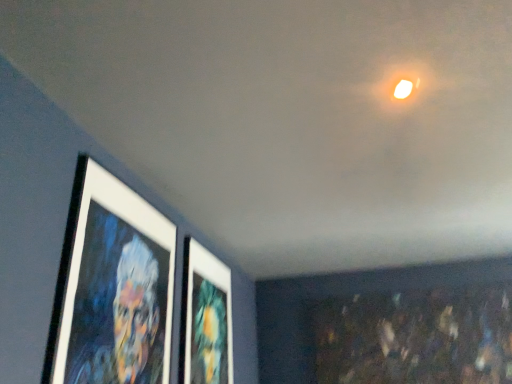
Measure the distance between point (127, 305) and camera.

The depth of point (127, 305) is 4.96 feet.

This screenshot has height=384, width=512. What do you see at coordinates (113, 286) in the screenshot? I see `white matte picture frame at left, the 2th picture frame from the back` at bounding box center [113, 286].

At what (x,y) coordinates should I click in order to perform the action: click on white matte picture frame at left, placed as the 1th picture frame when sorted from front to back. Please return your answer as a coordinate pair (x, y). Looking at the image, I should click on (113, 286).

Describe the element at coordinates (207, 318) in the screenshot. I see `matte white picture frame at center, arranged as the 2th picture frame when viewed from the front` at that location.

The width and height of the screenshot is (512, 384). Find the location of `matte white picture frame at center, acting as the 2th picture frame starting from the left`. matte white picture frame at center, acting as the 2th picture frame starting from the left is located at coordinates (207, 318).

Where is `white matte picture frame at left, placed as the 1th picture frame when sorted from front to back`? The width and height of the screenshot is (512, 384). white matte picture frame at left, placed as the 1th picture frame when sorted from front to back is located at coordinates (113, 286).

Which object is positioned more to the left, white matte picture frame at left, the 2th picture frame from the back, or matte white picture frame at center, the first picture frame in the back-to-front sequence?

white matte picture frame at left, the 2th picture frame from the back.

Considering the positions of objects white matte picture frame at left, placed as the second picture frame when sorted from right to left, and matte white picture frame at center, placed as the 1th picture frame when sorted from right to left, in the image provided, who is in front, white matte picture frame at left, placed as the second picture frame when sorted from right to left, or matte white picture frame at center, placed as the 1th picture frame when sorted from right to left,?

white matte picture frame at left, placed as the second picture frame when sorted from right to left.

Which point is more distant from viewer, (80,269) or (207,364)?

The point (207,364) is more distant.

From the image's perspective, is white matte picture frame at left, placed as the 1th picture frame when sorted from front to back, on matte white picture frame at center, placed as the 1th picture frame when sorted from right to left?

Yes, from the image's perspective, white matte picture frame at left, placed as the 1th picture frame when sorted from front to back, is on top of matte white picture frame at center, placed as the 1th picture frame when sorted from right to left.

From a real-world perspective, is white matte picture frame at left, placed as the 1th picture frame when sorted from front to back, physically located above or below matte white picture frame at center, arranged as the 2th picture frame when viewed from the front?

In terms of real-world spatial position, white matte picture frame at left, placed as the 1th picture frame when sorted from front to back, is below matte white picture frame at center, arranged as the 2th picture frame when viewed from the front.

Which object is thinner, white matte picture frame at left, placed as the second picture frame when sorted from right to left, or matte white picture frame at center, placed as the 1th picture frame when sorted from right to left?

white matte picture frame at left, placed as the second picture frame when sorted from right to left.

Which of these two, white matte picture frame at left, placed as the second picture frame when sorted from right to left, or matte white picture frame at center, the first picture frame in the back-to-front sequence, stands taller?

white matte picture frame at left, placed as the second picture frame when sorted from right to left, is taller.

Considering the sizes of objects white matte picture frame at left, placed as the 1th picture frame when sorted from front to back, and matte white picture frame at center, acting as the 2th picture frame starting from the left, in the image provided, who is bigger, white matte picture frame at left, placed as the 1th picture frame when sorted from front to back, or matte white picture frame at center, acting as the 2th picture frame starting from the left,?

matte white picture frame at center, acting as the 2th picture frame starting from the left.

Looking at this image, is white matte picture frame at left, the 2th picture frame from the back, spatially inside matte white picture frame at center, arranged as the 2th picture frame when viewed from the front, or outside of it?

white matte picture frame at left, the 2th picture frame from the back, is located beyond the bounds of matte white picture frame at center, arranged as the 2th picture frame when viewed from the front.

Are white matte picture frame at left, placed as the second picture frame when sorted from right to left, and matte white picture frame at center, arranged as the 2th picture frame when viewed from the front, far apart?

No.

Does white matte picture frame at left, marked as the 1th picture frame in a left-to-right arrangement, turn towards matte white picture frame at center, acting as the 2th picture frame starting from the left?

No, white matte picture frame at left, marked as the 1th picture frame in a left-to-right arrangement, is not oriented towards matte white picture frame at center, acting as the 2th picture frame starting from the left.

Can you tell me how much white matte picture frame at left, the 2th picture frame from the back, and matte white picture frame at center, acting as the 2th picture frame starting from the left, differ in facing direction?

0.00963 degrees.

The height and width of the screenshot is (384, 512). Identify the location of picture frame on the left of matte white picture frame at center, arranged as the 2th picture frame when viewed from the front. (113, 286).

Does matte white picture frame at center, arranged as the 2th picture frame when viewed from the front, appear on the right side of white matte picture frame at left, marked as the 1th picture frame in a left-to-right arrangement?

Yes, matte white picture frame at center, arranged as the 2th picture frame when viewed from the front, is to the right of white matte picture frame at left, marked as the 1th picture frame in a left-to-right arrangement.

Which is behind, matte white picture frame at center, the first picture frame in the back-to-front sequence, or white matte picture frame at left, placed as the 1th picture frame when sorted from front to back?

matte white picture frame at center, the first picture frame in the back-to-front sequence, is further from the camera.

Between point (201, 260) and point (121, 331), which one is positioned behind?

The point (201, 260) is farther.

From the image's perspective, relative to white matte picture frame at left, placed as the second picture frame when sorted from right to left, is matte white picture frame at center, placed as the 1th picture frame when sorted from right to left, above or below?

matte white picture frame at center, placed as the 1th picture frame when sorted from right to left, is situated lower than white matte picture frame at left, placed as the second picture frame when sorted from right to left, in the image.

From a real-world perspective, is matte white picture frame at center, the first picture frame in the back-to-front sequence, physically above white matte picture frame at left, marked as the 1th picture frame in a left-to-right arrangement?

Yes, from a real-world perspective, matte white picture frame at center, the first picture frame in the back-to-front sequence, is above white matte picture frame at left, marked as the 1th picture frame in a left-to-right arrangement.

Which object is wider, matte white picture frame at center, placed as the 1th picture frame when sorted from right to left, or white matte picture frame at left, placed as the second picture frame when sorted from right to left?

matte white picture frame at center, placed as the 1th picture frame when sorted from right to left, is wider.

Can you confirm if matte white picture frame at center, the first picture frame in the back-to-front sequence, is shorter than white matte picture frame at left, placed as the 1th picture frame when sorted from front to back?

Yes, matte white picture frame at center, the first picture frame in the back-to-front sequence, is shorter than white matte picture frame at left, placed as the 1th picture frame when sorted from front to back.

Considering the sizes of objects matte white picture frame at center, the first picture frame in the back-to-front sequence, and white matte picture frame at left, the 2th picture frame from the back, in the image provided, who is bigger, matte white picture frame at center, the first picture frame in the back-to-front sequence, or white matte picture frame at left, the 2th picture frame from the back,?

Bigger between the two is matte white picture frame at center, the first picture frame in the back-to-front sequence.

Would you say matte white picture frame at center, acting as the 2th picture frame starting from the left, is outside white matte picture frame at left, placed as the second picture frame when sorted from right to left?

Indeed, matte white picture frame at center, acting as the 2th picture frame starting from the left, is completely outside white matte picture frame at left, placed as the second picture frame when sorted from right to left.

Is matte white picture frame at center, the first picture frame in the back-to-front sequence, facing towards white matte picture frame at left, marked as the 1th picture frame in a left-to-right arrangement?

No, matte white picture frame at center, the first picture frame in the back-to-front sequence, is not oriented towards white matte picture frame at left, marked as the 1th picture frame in a left-to-right arrangement.

Image resolution: width=512 pixels, height=384 pixels. In order to click on picture frame that appears in front of the matte white picture frame at center, arranged as the 2th picture frame when viewed from the front in this screenshot , I will do `click(113, 286)`.

This screenshot has width=512, height=384. Identify the location of picture frame below the matte white picture frame at center, acting as the 2th picture frame starting from the left (from a real-world perspective). [x=113, y=286].

At what (x,y) coordinates should I click in order to perform the action: click on picture frame that appears in front of the matte white picture frame at center, the first picture frame in the back-to-front sequence. Please return your answer as a coordinate pair (x, y). Image resolution: width=512 pixels, height=384 pixels. Looking at the image, I should click on (113, 286).